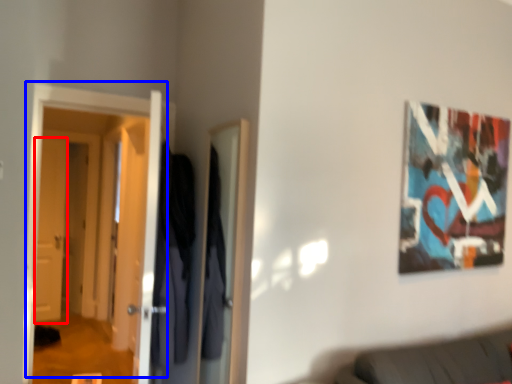
Question: Which object appears farthest to the camera in this image, door (highlighted by a red box) or door (highlighted by a blue box)?

Choices:
 (A) door
 (B) door

Answer: (A)